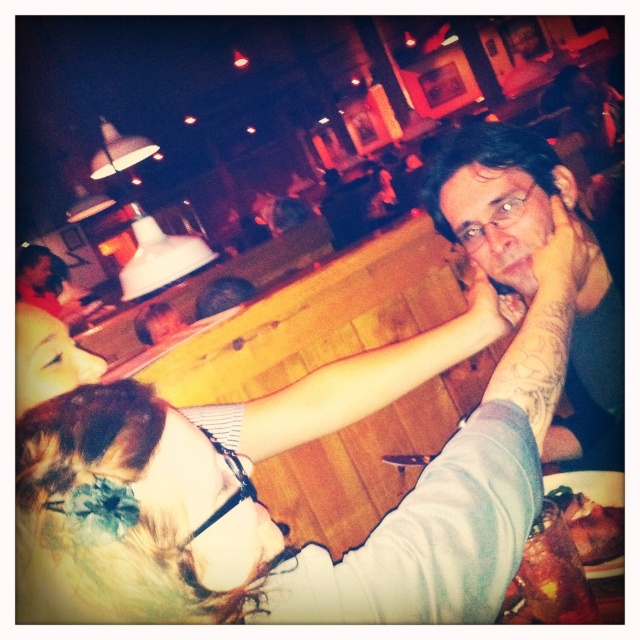
Question: Which point is farther to the camera?

Choices:
 (A) (513, 324)
 (B) (589, 518)
 (C) (269, 602)

Answer: (A)

Question: Is multicolored fabric at center to the left of smooth wooden arm at center from the viewer's perspective?

Choices:
 (A) yes
 (B) no

Answer: (A)

Question: Observing the image, what is the correct spatial positioning of brown crispy chicken at lower right in reference to smooth skin hand at center?

Choices:
 (A) below
 (B) above

Answer: (A)

Question: Which object appears closest to the camera in this image?

Choices:
 (A) brown crispy chicken at lower right
 (B) smooth wooden arm at center
 (C) wooden table at lower right
 (D) matte black glasses at upper right

Answer: (C)

Question: Estimate the real-world distances between objects in this image. Which object is closer to the smooth skin hand at center?

Choices:
 (A) multicolored fabric at center
 (B) smooth skin hand at upper right
 (C) brown crispy chicken at lower right
 (D) smooth wooden arm at center

Answer: (B)

Question: Can you confirm if multicolored fabric at center is smaller than wooden table at lower right?

Choices:
 (A) no
 (B) yes

Answer: (A)